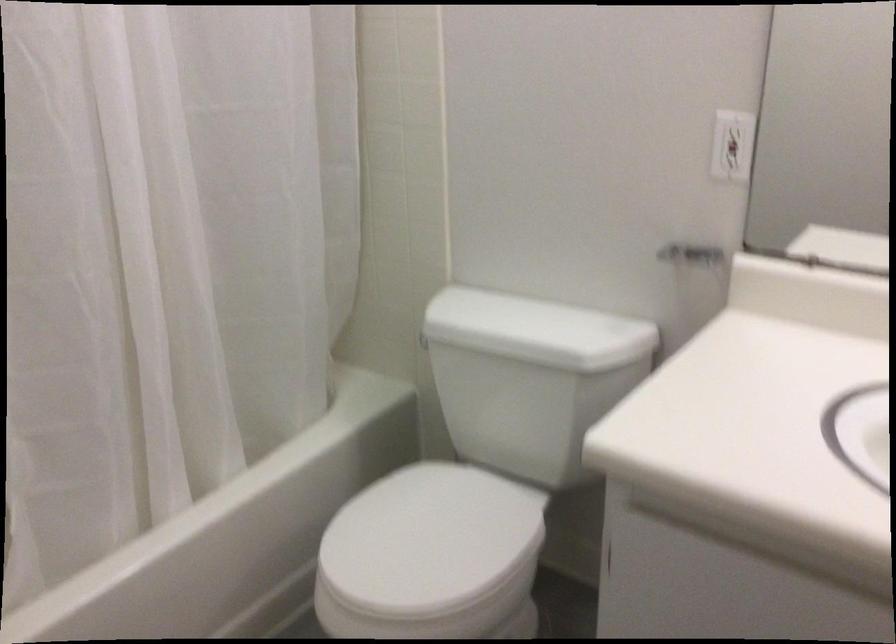
Where is `outlet switch`? outlet switch is located at coordinates (731, 145).